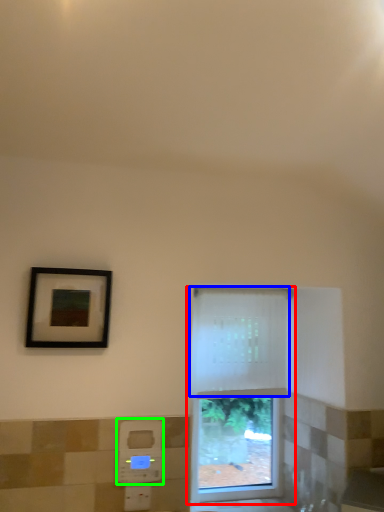
Question: Considering the real-world distances, which object is farthest from window (highlighted by a red box)? curtain (highlighted by a blue box) or hand dryer (highlighted by a green box)?

Choices:
 (A) curtain
 (B) hand dryer

Answer: (B)